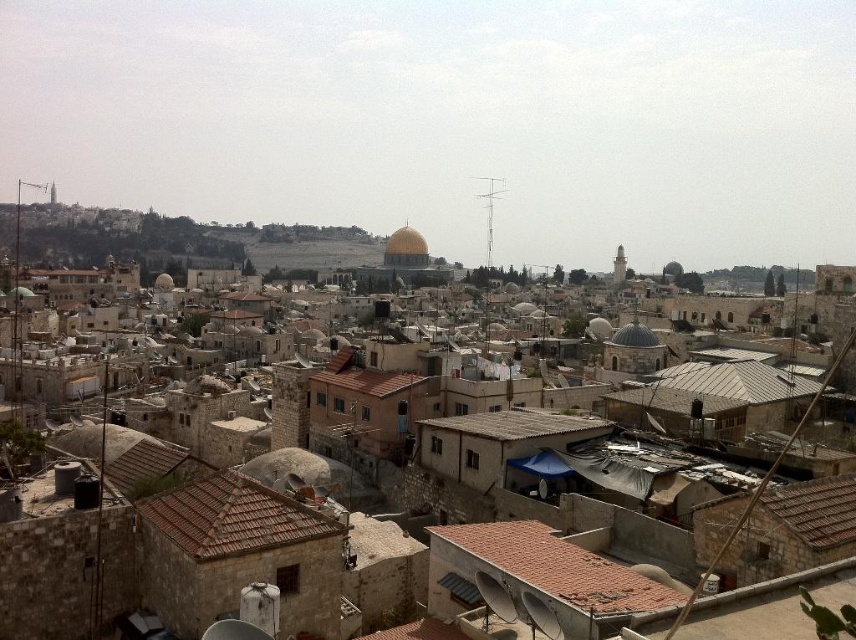
You are standing in the historic city depicted in the image. You notice two points marked in the scene. Which point, point (215, 513) or point (391, 390), is nearer to you?

Point (215, 513) is closer to the viewer than point (391, 390).

You are a tourist standing in the city square and see the brown tiled roof at lower center and the brown tile roof at center. Which one is closer to you?

The brown tiled roof at lower center is closer to you because it is in front of the brown tile roof at center.